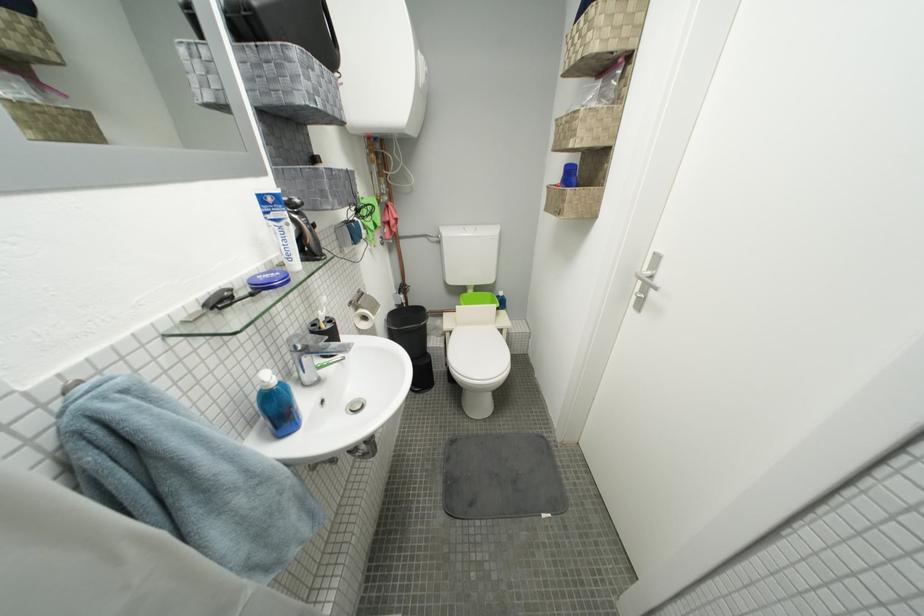
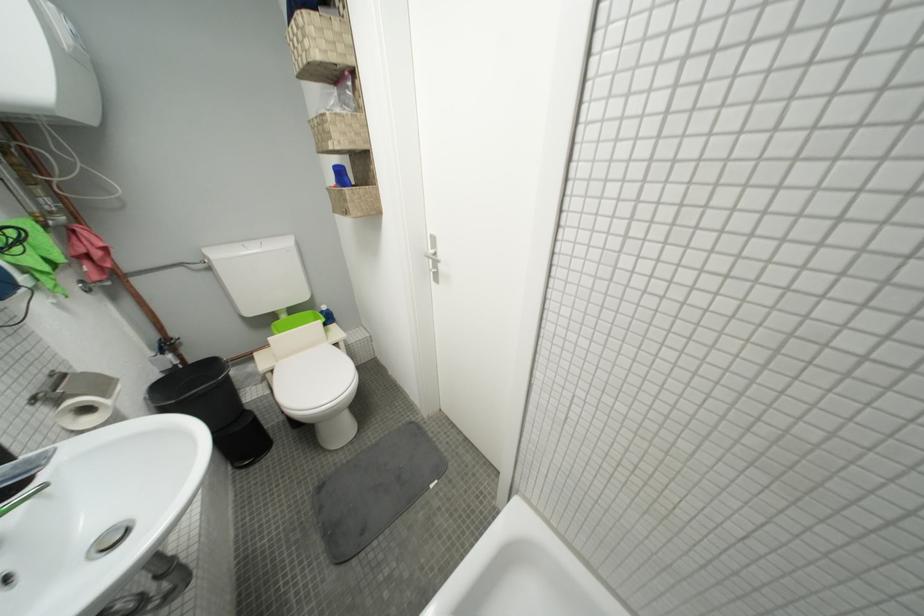
Find the pixel in the second image that matches point 459,334 in the first image.

(281, 373)